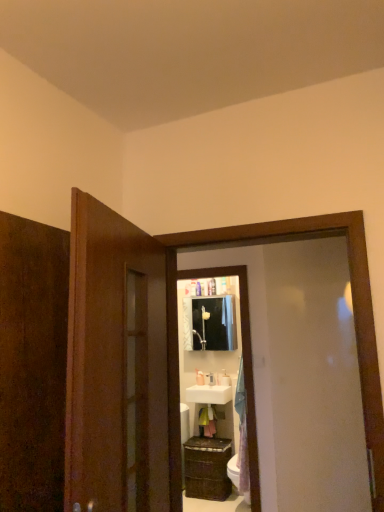
Question: Does wooden cabinet at lower center turn towards white glossy soap dispenser at center, acting as the second toiletry starting from the right?

Choices:
 (A) no
 (B) yes

Answer: (A)

Question: From a real-world perspective, does wooden cabinet at lower center sit lower than white glossy soap dispenser at center, acting as the second toiletry starting from the right?

Choices:
 (A) no
 (B) yes

Answer: (B)

Question: Is wooden cabinet at lower center not inside white glossy soap dispenser at center, acting as the second toiletry starting from the right?

Choices:
 (A) yes
 (B) no

Answer: (A)

Question: From a real-world perspective, is wooden cabinet at lower center positioned over white glossy soap dispenser at center, placed as the second toiletry when sorted from left to right, based on gravity?

Choices:
 (A) no
 (B) yes

Answer: (A)

Question: Does wooden cabinet at lower center have a lesser height compared to white glossy soap dispenser at center, placed as the second toiletry when sorted from left to right?

Choices:
 (A) no
 (B) yes

Answer: (A)

Question: From the image's perspective, does wooden cabinet at lower center appear higher than white glossy soap dispenser at center, acting as the second toiletry starting from the right?

Choices:
 (A) yes
 (B) no

Answer: (B)

Question: Is matte white medicine cabinet at center positioned in front of white glossy toilet bowl at lower right?

Choices:
 (A) no
 (B) yes

Answer: (A)

Question: Are matte white medicine cabinet at center and white glossy toilet bowl at lower right located far from each other?

Choices:
 (A) yes
 (B) no

Answer: (A)

Question: Is white glossy toilet bowl at lower right inside matte white medicine cabinet at center?

Choices:
 (A) yes
 (B) no

Answer: (B)

Question: Does matte white medicine cabinet at center turn towards white glossy toilet bowl at lower right?

Choices:
 (A) no
 (B) yes

Answer: (A)

Question: Considering the relative sizes of matte white medicine cabinet at center and white glossy toilet bowl at lower right in the image provided, is matte white medicine cabinet at center shorter than white glossy toilet bowl at lower right?

Choices:
 (A) yes
 (B) no

Answer: (B)

Question: Is white glossy toilet bowl at lower right at the back of matte white medicine cabinet at center?

Choices:
 (A) no
 (B) yes

Answer: (A)

Question: Is matte white medicine cabinet at center not near white glossy soap dispenser at center, acting as the second toiletry starting from the right?

Choices:
 (A) yes
 (B) no

Answer: (B)